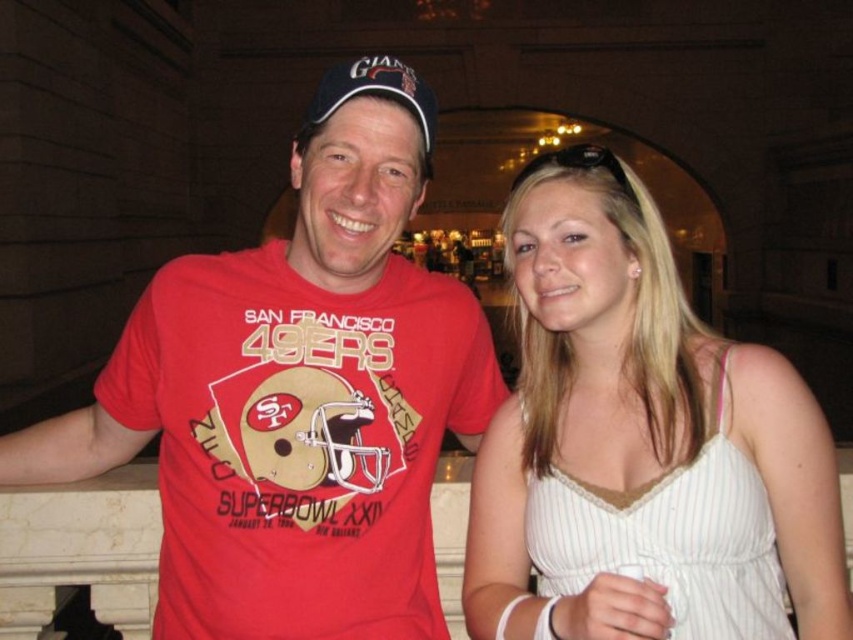
Question: Which point appears closest to the camera in this image?

Choices:
 (A) (306, 108)
 (B) (352, 320)
 (C) (647, 486)

Answer: (C)

Question: Which point is closer to the camera taking this photo?

Choices:
 (A) (569, 326)
 (B) (321, 468)
 (C) (354, 88)

Answer: (C)

Question: Which point is farther to the camera?

Choices:
 (A) blue fabric baseball cap at center
 (B) white striped dress at center
 (C) red matte t-shirt at center

Answer: (C)

Question: Observing the image, what is the correct spatial positioning of white striped dress at center in reference to blue fabric baseball cap at center?

Choices:
 (A) above
 (B) below

Answer: (B)

Question: Is red matte t-shirt at center thinner than blue fabric baseball cap at center?

Choices:
 (A) yes
 (B) no

Answer: (A)

Question: Considering the relative positions of red matte t-shirt at center and white striped dress at center in the image provided, where is red matte t-shirt at center located with respect to white striped dress at center?

Choices:
 (A) below
 (B) above

Answer: (A)